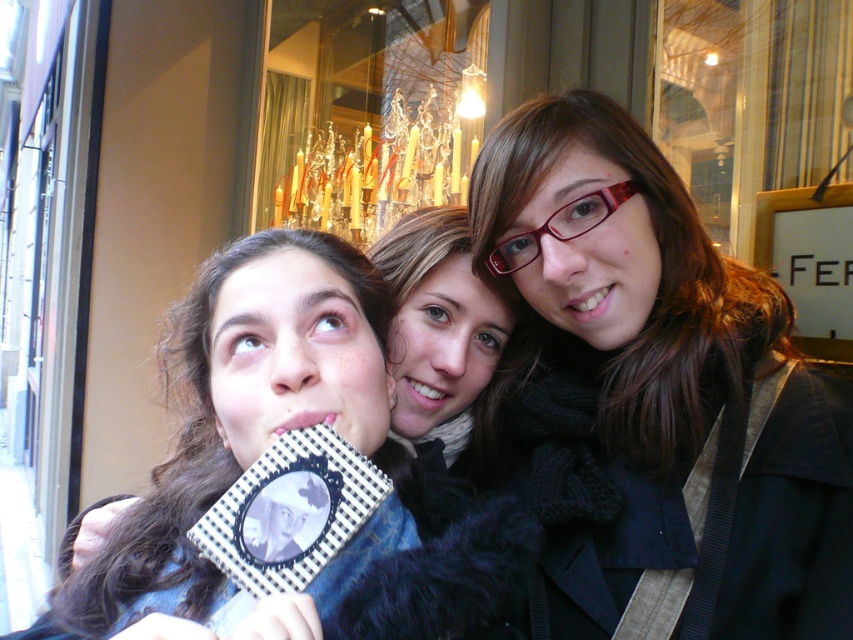
Question: Does matte black scarf at center have a smaller size compared to crystal chandelier at upper center?

Choices:
 (A) yes
 (B) no

Answer: (A)

Question: Which of the following is the closest to the observer?

Choices:
 (A) (450, 618)
 (B) (323, 13)

Answer: (A)

Question: Which point appears closest to the camera in this image?

Choices:
 (A) (415, 193)
 (B) (161, 484)

Answer: (B)

Question: Among these objects, which one is farthest from the camera?

Choices:
 (A) crystal chandelier at upper center
 (B) matte black book at center

Answer: (A)

Question: Is matte black scarf at center further to camera compared to crystal chandelier at upper center?

Choices:
 (A) yes
 (B) no

Answer: (B)

Question: Does matte black scarf at center have a larger size compared to matte black book at center?

Choices:
 (A) yes
 (B) no

Answer: (B)